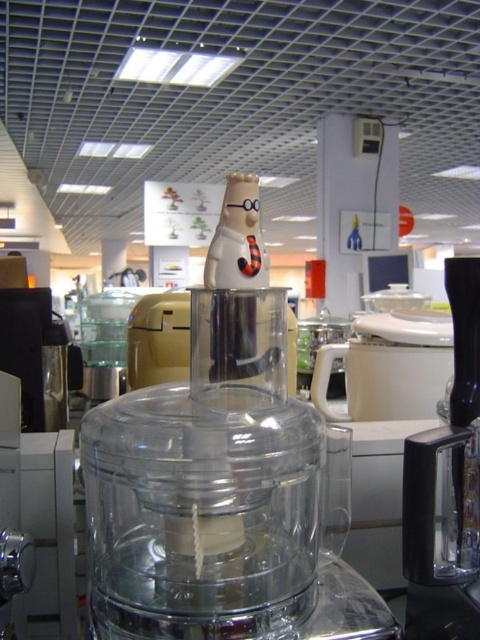
Question: Does transparent plastic mixer at center have a smaller size compared to black plastic blender at center?

Choices:
 (A) no
 (B) yes

Answer: (A)

Question: Which object is farther from the camera taking this photo?

Choices:
 (A) transparent plastic mixer at center
 (B) black plastic blender at center

Answer: (B)

Question: Which of the following is the farthest from the observer?

Choices:
 (A) (167, 548)
 (B) (471, 577)

Answer: (B)

Question: In this image, where is transparent plastic mixer at center located relative to black plastic blender at center?

Choices:
 (A) left
 (B) right

Answer: (A)

Question: Is transparent plastic mixer at center below black plastic blender at center?

Choices:
 (A) no
 (B) yes

Answer: (A)